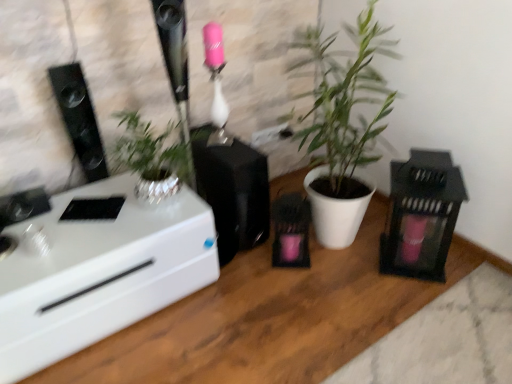
What are the coordinates of `free space in front of black matte speaker at center, which is counted as the first appliance, starting from the left` in the screenshot? It's located at (257, 282).